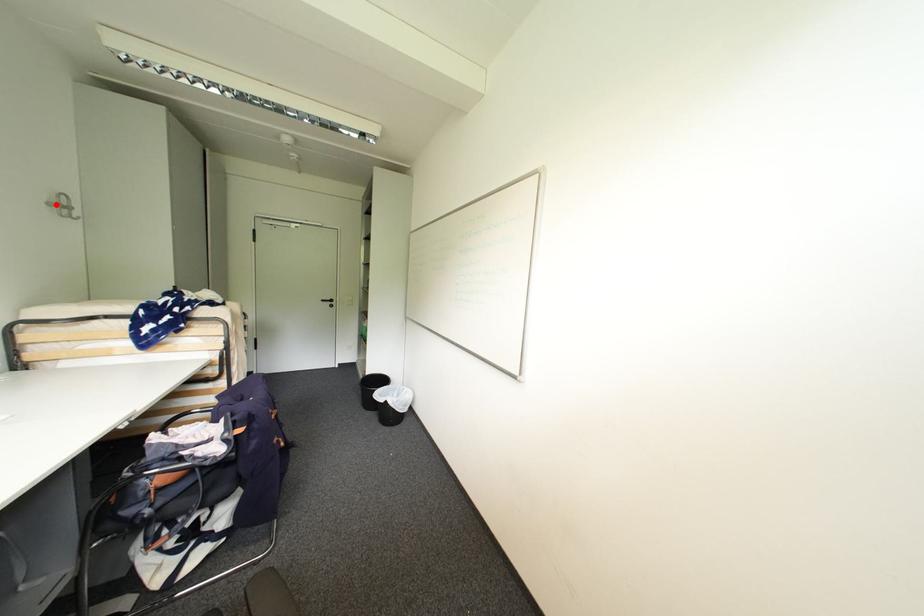
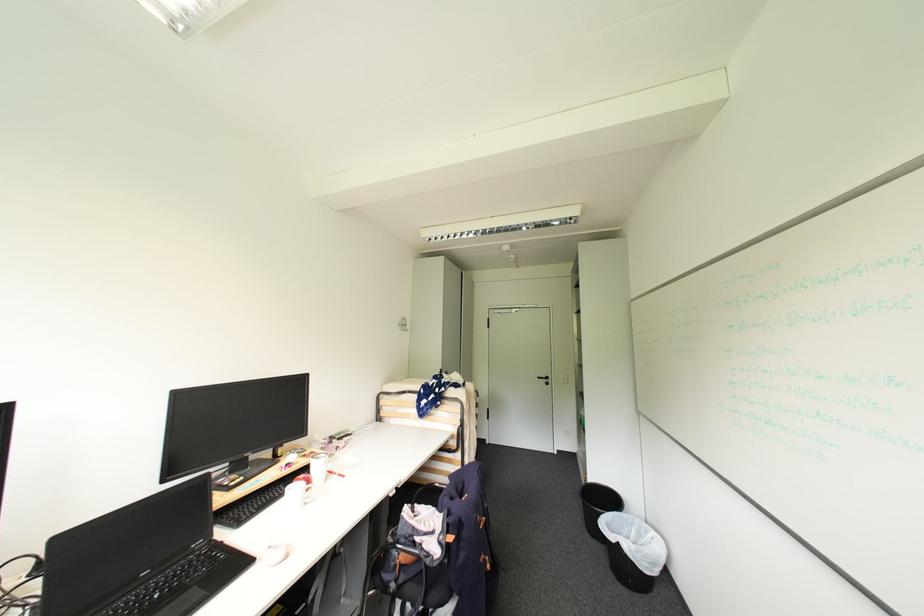
Where in the second image is the point corresponding to the highlighted location from the first image?

(406, 325)